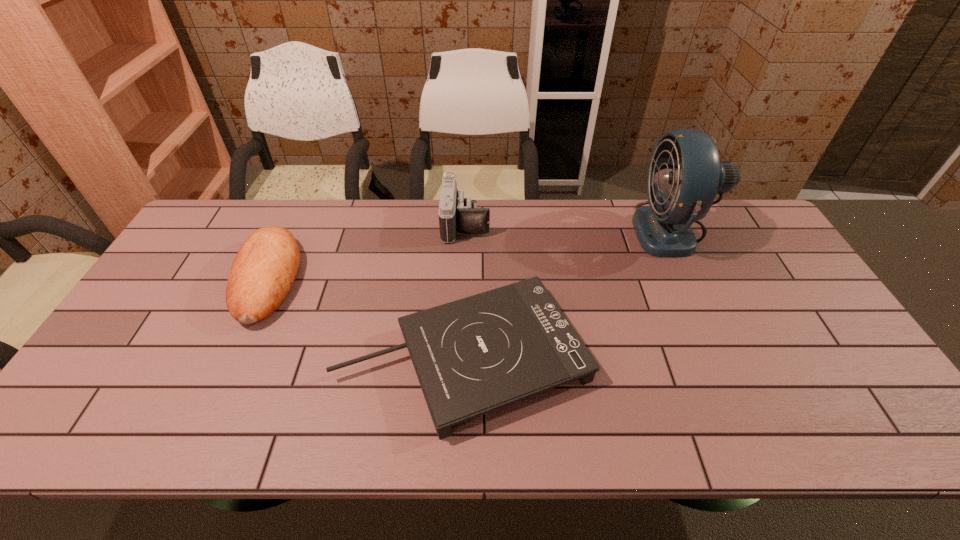
Locate an element on the screen. This screenshot has height=540, width=960. free space at the near left corner of the desktop is located at coordinates (66, 428).

Locate an element on the screen. The width and height of the screenshot is (960, 540). vacant region at the far right corner of the desktop is located at coordinates (751, 207).

The image size is (960, 540). I want to click on unoccupied area between the camera and the shortest object, so click(x=465, y=290).

This screenshot has width=960, height=540. Identify the location of free space between the rightmost object and the leftmost object. (470, 255).

This screenshot has height=540, width=960. I want to click on free space between the shortest object and the fan, so click(567, 293).

The width and height of the screenshot is (960, 540). I want to click on free space between the camera and the hotplate, so click(465, 290).

I want to click on free space between the shortest object and the camera, so click(x=465, y=290).

Locate an element on the screen. This screenshot has width=960, height=540. vacant space in between the hotplate and the bread is located at coordinates (366, 318).

You are a GUI agent. You are given a task and a screenshot of the screen. Output one action in this format:
    pyautogui.click(x=<x>, y=<y>)
    Task: Click on the empty space that is in between the hotplate and the bread
    The image size is (960, 540).
    Given the screenshot: What is the action you would take?
    pyautogui.click(x=366, y=318)

Find the location of `free area in between the tallest object and the camera`. free area in between the tallest object and the camera is located at coordinates (568, 227).